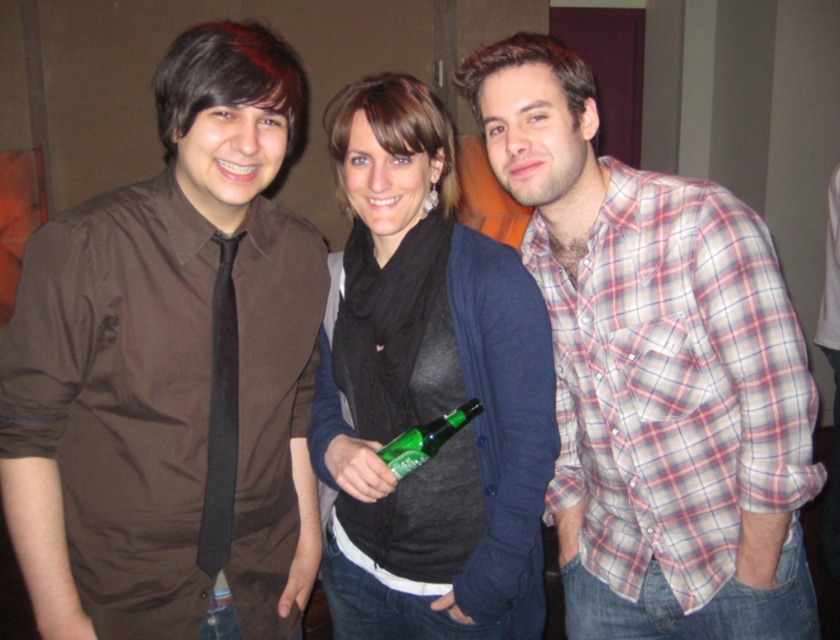
Consider the image. You are at a party and need to grab the green glass bottle at center without touching the matte brown shirt at left. Is this possible?

The matte brown shirt at left is positioned over the green glass bottle at center, so you cannot grab the green glass bottle at center without moving the matte brown shirt at left first.

You are organizing a charity event and need to ensure that all items displayed are appropriately sized. You have a display case that can only accommodate items smaller than the plaid cotton shirt at center. Can the matte black scarf at center fit in the display case?

The plaid cotton shirt at center is bigger than the matte black scarf at center, so the matte black scarf at center can fit in the display case since it is smaller than the plaid cotton shirt at center.

You are organizing a clothing donation drive and need to determine which item takes up more space between the plaid cotton shirt at center and the matte black scarf at center. Which item should you allocate more storage space for?

The plaid cotton shirt at center has a greater width than the matte black scarf at center, so you should allocate more storage space for the plaid cotton shirt at center.